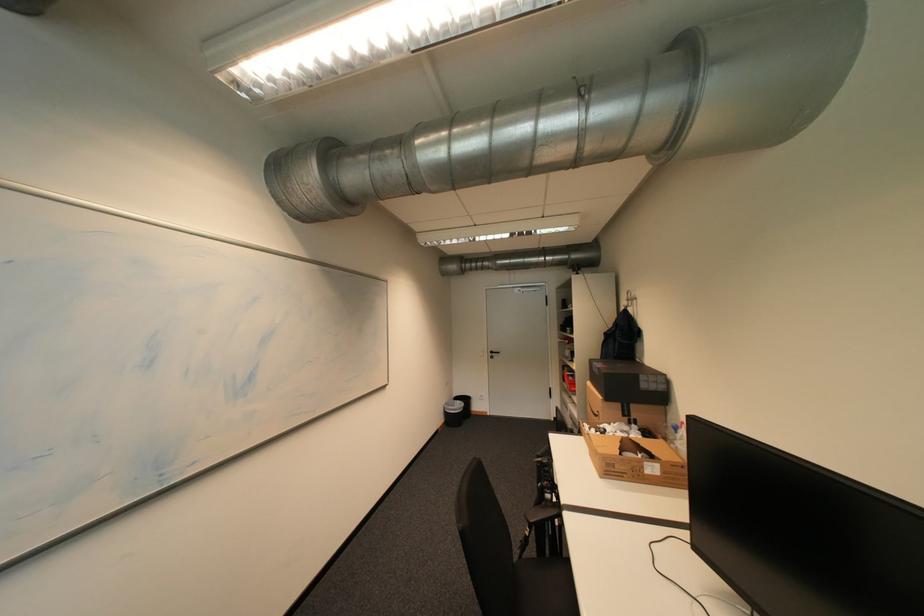
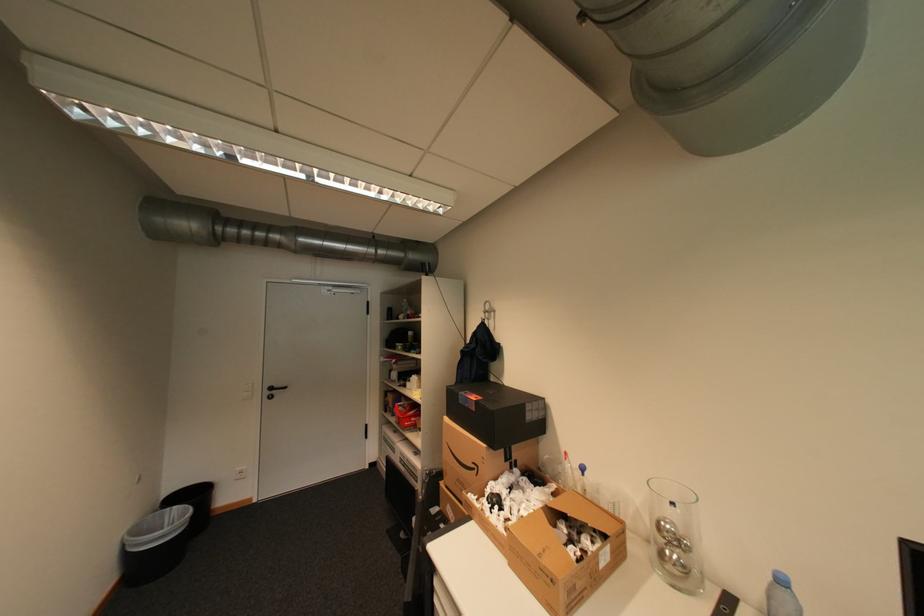
Find the pixel in the second image that matches (x=500, y=353) in the first image.

(280, 389)